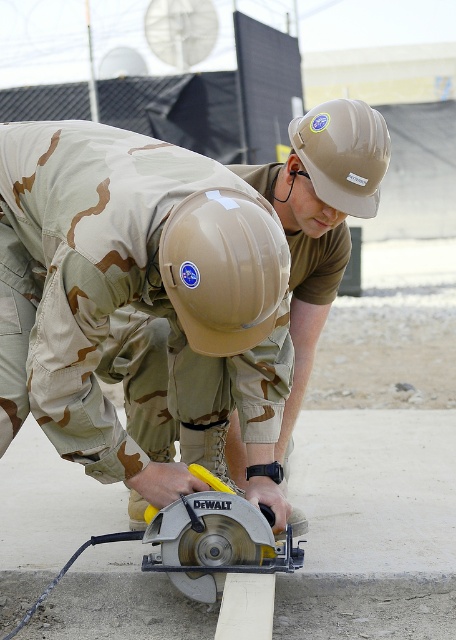
You are a safety inspector checking the construction site. You notice the tan matte hard hat at center and the yellow plastic circular saw at center. According to safety protocols, which object should be positioned higher to ensure the worker is protected from falling debris?

The tan matte hard hat at center should be positioned higher than the yellow plastic circular saw at center to ensure the worker is protected from falling debris, as the hard hat is designed to shield the head from hazards.

You are a construction worker who needs to reach the yellow plastic circular saw at center and the tan matte hard hat at upper center. If you can only move 3 feet, which object can you reach?

The tan matte hard hat at upper center is 3 feet away from the yellow plastic circular saw at center, so if you can only move 3 feet, you can reach both objects.